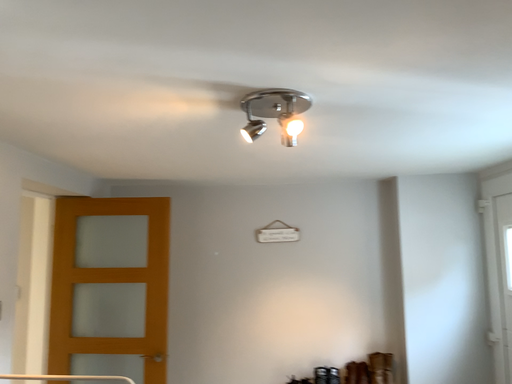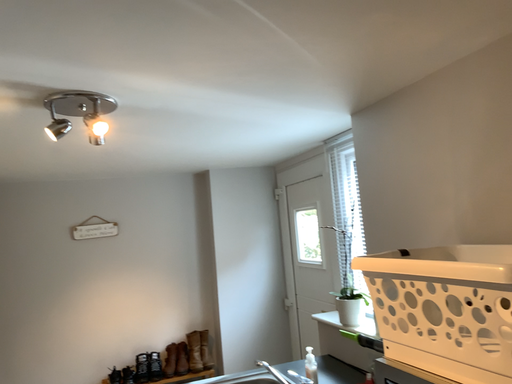
Question: Which way did the camera rotate in the video?

Choices:
 (A) rotated right
 (B) rotated left

Answer: (A)